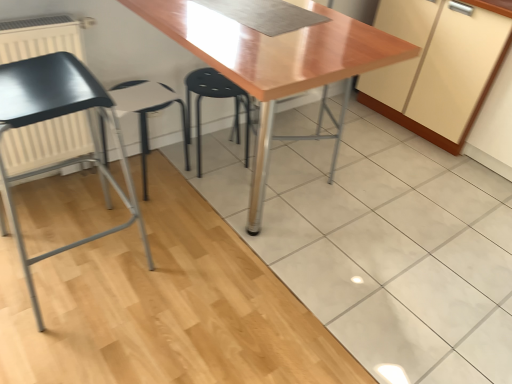
Question: From a real-world perspective, is black plastic stool at center above or below matte black chair at left?

Choices:
 (A) below
 (B) above

Answer: (A)

Question: Is black plastic stool at center bigger or smaller than matte black chair at left?

Choices:
 (A) small
 (B) big

Answer: (A)

Question: Estimate the real-world distances between objects in this image. Which object is closer to the white matte radiator at left?

Choices:
 (A) black plastic stool at center
 (B) glossy wood table at center
 (C) white plastic stool at center
 (D) matte black chair at left

Answer: (D)

Question: Estimate the real-world distances between objects in this image. Which object is closer to the glossy wood table at center?

Choices:
 (A) white matte radiator at left
 (B) black plastic stool at center
 (C) matte black chair at left
 (D) white plastic stool at center

Answer: (B)